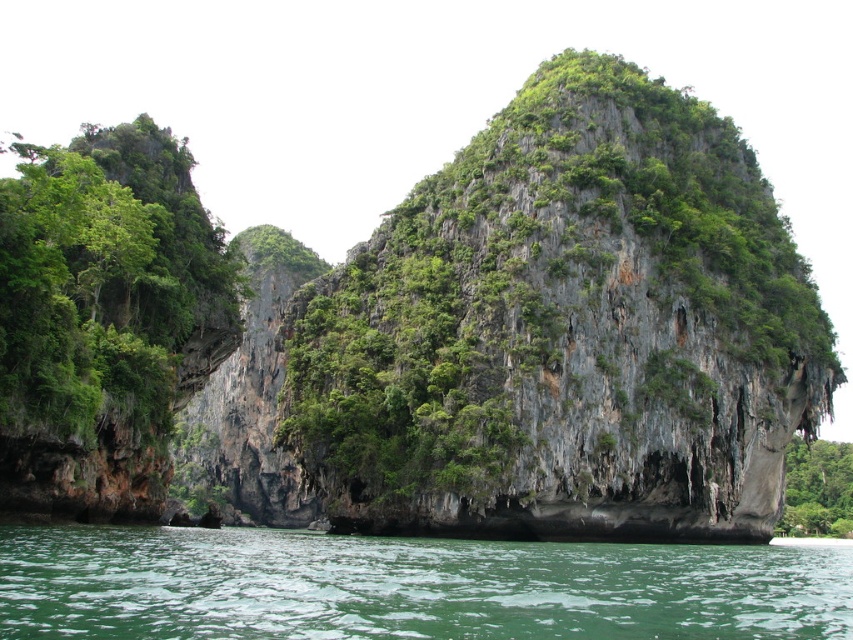
Consider the image. Is green liquid water at lower center in front of green leafy vegetation at lower right?

Yes, green liquid water at lower center is in front of green leafy vegetation at lower right.

This screenshot has height=640, width=853. Describe the element at coordinates (407, 586) in the screenshot. I see `green liquid water at lower center` at that location.

In order to click on green liquid water at lower center in this screenshot , I will do (x=407, y=586).

Between point (467, 625) and point (61, 179), which one is positioned behind?

The point (61, 179) is more distant.

Can you confirm if green liquid water at lower center is positioned above green leafy vegetation at left?

Actually, green liquid water at lower center is below green leafy vegetation at left.

In order to click on green liquid water at lower center in this screenshot , I will do `click(407, 586)`.

Identify the location of green liquid water at lower center. Image resolution: width=853 pixels, height=640 pixels. (407, 586).

Is green leafy vegetation at left in front of green leafy vegetation at lower right?

Yes.

Where is `green leafy vegetation at left`? This screenshot has width=853, height=640. green leafy vegetation at left is located at coordinates (103, 276).